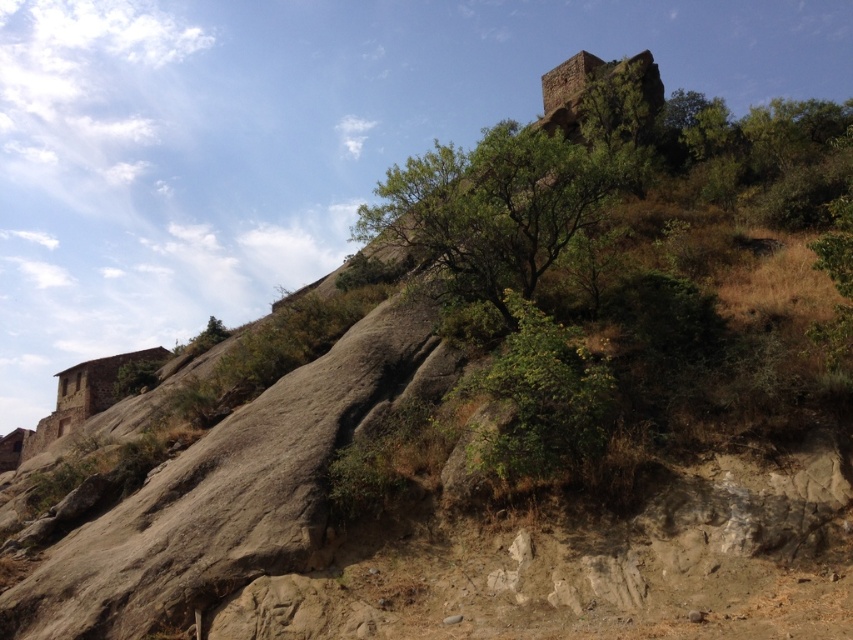
You are a hiker trying to navigate through the rocky hillside. You notice a green leafy tree at center and a green leafy bush at center. Which one is wider?

The green leafy tree at center is wider than the green leafy bush at center.